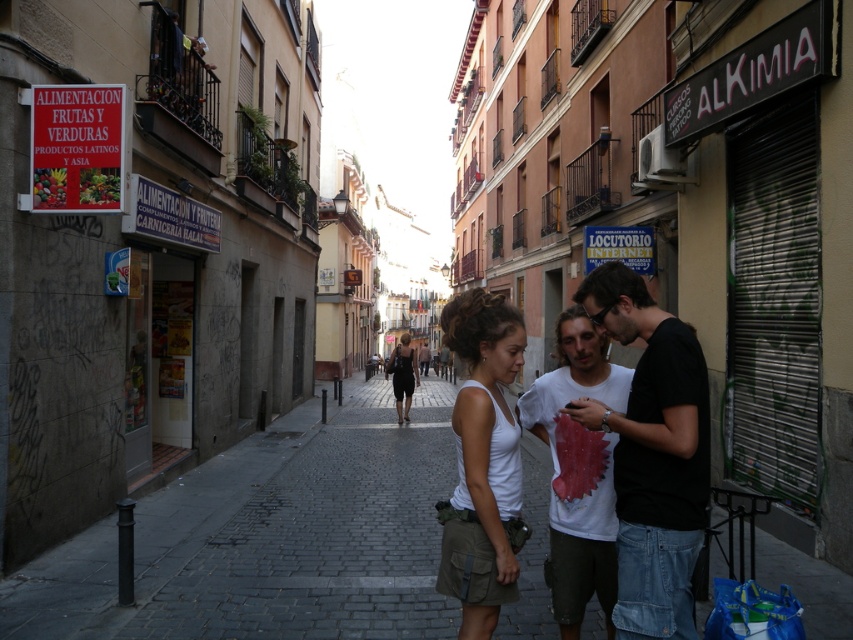
You are a tourist walking down the narrow cobblestone street in a European city. You notice the dark gray cobblestone at center and the black matte shirt at center. Which object is positioned lower from the ground?

The dark gray cobblestone at center is positioned lower from the ground than the black matte shirt at center because it is below it.

You are a delivery person standing on the dark gray cobblestone at center and need to place a package on the black matte shirt at center. Can the package fit on the shirt if the package is as wide as the cobblestone?

The dark gray cobblestone at center is wider than the black matte shirt at center, so the package, which is as wide as the cobblestone, may not fit entirely on the shirt.

You are a fashion designer attending a market in a Spanish city. You notice two items hanging on a rack in the middle of the street. The items are a white cotton tank top at center and a black satin dress at center. Which item is smaller in size?

The white cotton tank top at center has a smaller size compared to the black satin dress at center, so the white cotton tank top at center is the smaller item.